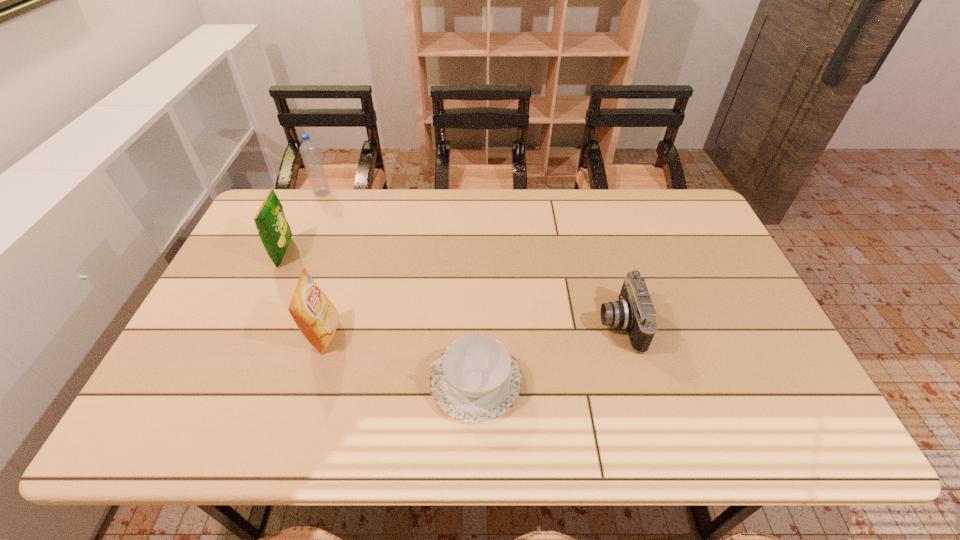
The image size is (960, 540). What are the coordinates of `water bottle located in the left edge section of the desktop` in the screenshot? It's located at (309, 150).

The image size is (960, 540). In order to click on crisp (potato chip) that is at the left edge in this screenshot , I will do `click(275, 233)`.

You are a GUI agent. You are given a task and a screenshot of the screen. Output one action in this format:
    pyautogui.click(x=<x>, y=<y>)
    Task: Click on the object that is at the far left corner
    The height and width of the screenshot is (540, 960).
    Given the screenshot: What is the action you would take?
    pyautogui.click(x=309, y=150)

Identify the location of free location at the far edge of the desktop. The image size is (960, 540). (342, 222).

In the image, there is a desktop. Where is `vacant space at the near edge`? The width and height of the screenshot is (960, 540). vacant space at the near edge is located at coordinates (294, 429).

In order to click on vacant region at the left edge of the desktop in this screenshot , I will do `click(236, 292)`.

In the image, there is a desktop. Where is `vacant space at the right edge`? The image size is (960, 540). vacant space at the right edge is located at coordinates (741, 345).

The height and width of the screenshot is (540, 960). I want to click on blank area at the far right corner, so click(708, 231).

Locate an element on the screen. The height and width of the screenshot is (540, 960). vacant region between the camera and the nearer crisp (potato chip) is located at coordinates (471, 329).

Where is `vacant region between the farther crisp (potato chip) and the farthest object`? The width and height of the screenshot is (960, 540). vacant region between the farther crisp (potato chip) and the farthest object is located at coordinates (303, 223).